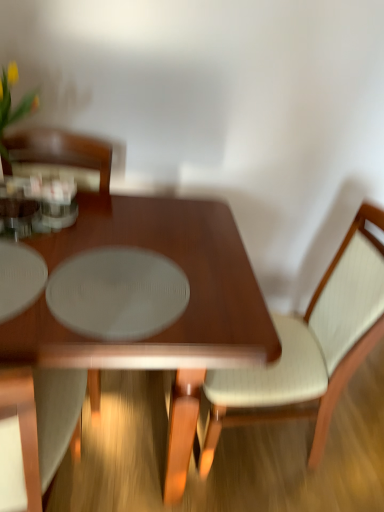
Describe the element at coordinates (155, 335) in the screenshot. I see `shiny brown table at center` at that location.

Describe the element at coordinates (310, 347) in the screenshot. I see `light beige fabric chair at center, placed as the 2th chair when sorted from left to right` at that location.

The height and width of the screenshot is (512, 384). Identify the location of shiny brown table at center. (155, 335).

From their relative heights in the image, would you say white fabric chair at left, the 1th chair from the left, is taller or shorter than light beige fabric chair at center, positioned as the first chair in right-to-left order?

Clearly, white fabric chair at left, the 1th chair from the left, is taller compared to light beige fabric chair at center, positioned as the first chair in right-to-left order.

Does white fabric chair at left, the 1th chair from the left, have a larger size compared to light beige fabric chair at center, placed as the 2th chair when sorted from left to right?

Actually, white fabric chair at left, the 1th chair from the left, might be smaller than light beige fabric chair at center, placed as the 2th chair when sorted from left to right.

Based on the photo, from the image's perspective, relative to light beige fabric chair at center, placed as the 2th chair when sorted from left to right, is white fabric chair at left, acting as the 2th chair starting from the right, above or below?

From the image's perspective, white fabric chair at left, acting as the 2th chair starting from the right, appears below light beige fabric chair at center, placed as the 2th chair when sorted from left to right.

Image resolution: width=384 pixels, height=512 pixels. In the image, there is a white fabric chair at left, the 1th chair from the left. Identify the location of chair below it (from a real-world perspective). (310, 347).

Image resolution: width=384 pixels, height=512 pixels. I want to click on chair that is the 1st one above the shiny brown table at center (from a real-world perspective), so click(310, 347).

Which object is positioned more to the left, shiny brown table at center or light beige fabric chair at center, positioned as the first chair in right-to-left order?

shiny brown table at center is more to the left.

Does point (167, 230) come closer to viewer compared to point (225, 423)?

Yes, it is.

Who is more distant, shiny brown table at center or white fabric chair at left, the 1th chair from the left?

shiny brown table at center is behind.

Would you consider shiny brown table at center to be distant from white fabric chair at left, acting as the 2th chair starting from the right?

No, shiny brown table at center is in close proximity to white fabric chair at left, acting as the 2th chair starting from the right.

Measure the distance between shiny brown table at center and white fabric chair at left, acting as the 2th chair starting from the right.

shiny brown table at center and white fabric chair at left, acting as the 2th chair starting from the right, are 13.07 inches apart.

Does shiny brown table at center turn towards white fabric chair at left, acting as the 2th chair starting from the right?

Yes, shiny brown table at center is turned towards white fabric chair at left, acting as the 2th chair starting from the right.

Is light beige fabric chair at center, positioned as the first chair in right-to-left order, positioned with its back to shiny brown table at center?

No, shiny brown table at center is not at the back of light beige fabric chair at center, positioned as the first chair in right-to-left order.

At what (x,y) coordinates should I click in order to perform the action: click on coffee table that is on the left side of light beige fabric chair at center, positioned as the first chair in right-to-left order. Please return your answer as a coordinate pair (x, y). The image size is (384, 512). Looking at the image, I should click on (155, 335).

Can you confirm if light beige fabric chair at center, placed as the 2th chair when sorted from left to right, is shorter than shiny brown table at center?

Incorrect, the height of light beige fabric chair at center, placed as the 2th chair when sorted from left to right, does not fall short of that of shiny brown table at center.

From the image's perspective, is light beige fabric chair at center, placed as the 2th chair when sorted from left to right, beneath shiny brown table at center?

No.

Is light beige fabric chair at center, positioned as the first chair in right-to-left order, at the left side of white fabric chair at left, acting as the 2th chair starting from the right?

Incorrect, light beige fabric chair at center, positioned as the first chair in right-to-left order, is not on the left side of white fabric chair at left, acting as the 2th chair starting from the right.

Does light beige fabric chair at center, positioned as the first chair in right-to-left order, have a greater height compared to white fabric chair at left, the 1th chair from the left?

No, light beige fabric chair at center, positioned as the first chair in right-to-left order, is not taller than white fabric chair at left, the 1th chair from the left.

From the image's perspective, is light beige fabric chair at center, placed as the 2th chair when sorted from left to right, positioned above or below white fabric chair at left, the 1th chair from the left?

Clearly, from the image's perspective, light beige fabric chair at center, placed as the 2th chair when sorted from left to right, is above white fabric chair at left, the 1th chair from the left.

Is point (57, 430) closer or farther from the camera than point (29, 389)?

Point (57, 430) appears to be farther away from the viewer than point (29, 389).

Considering the relative positions of white fabric chair at left, the 1th chair from the left, and shiny brown table at center in the image provided, is white fabric chair at left, the 1th chair from the left, to the right of shiny brown table at center from the viewer's perspective?

Incorrect, white fabric chair at left, the 1th chair from the left, is not on the right side of shiny brown table at center.

Considering the relative sizes of white fabric chair at left, the 1th chair from the left, and shiny brown table at center in the image provided, is white fabric chair at left, the 1th chair from the left, shorter than shiny brown table at center?

No.

Is white fabric chair at left, acting as the 2th chair starting from the right, positioned far away from shiny brown table at center?

No, white fabric chair at left, acting as the 2th chair starting from the right, is not far from shiny brown table at center.

Identify the location of chair behind the white fabric chair at left, the 1th chair from the left. The image size is (384, 512). (310, 347).

Locate an element on the screen. The height and width of the screenshot is (512, 384). coffee table on the left of the light beige fabric chair at center, positioned as the first chair in right-to-left order is located at coordinates (155, 335).

From the picture: Looking at the image, which one is located further to white fabric chair at left, the 1th chair from the left, shiny brown table at center or light beige fabric chair at center, positioned as the first chair in right-to-left order?

light beige fabric chair at center, positioned as the first chair in right-to-left order.

Looking at the image, which one is located closer to light beige fabric chair at center, positioned as the first chair in right-to-left order, white fabric chair at left, acting as the 2th chair starting from the right, or shiny brown table at center?

shiny brown table at center.

Estimate the real-world distances between objects in this image. Which object is further from light beige fabric chair at center, positioned as the first chair in right-to-left order, shiny brown table at center or white fabric chair at left, acting as the 2th chair starting from the right?

The object further to light beige fabric chair at center, positioned as the first chair in right-to-left order, is white fabric chair at left, acting as the 2th chair starting from the right.

Looking at the image, which one is located closer to white fabric chair at left, acting as the 2th chair starting from the right, light beige fabric chair at center, positioned as the first chair in right-to-left order, or shiny brown table at center?

Among the two, shiny brown table at center is located nearer to white fabric chair at left, acting as the 2th chair starting from the right.

Based on their spatial positions, is light beige fabric chair at center, placed as the 2th chair when sorted from left to right, or white fabric chair at left, acting as the 2th chair starting from the right, closer to shiny brown table at center?

Based on the image, white fabric chair at left, acting as the 2th chair starting from the right, appears to be nearer to shiny brown table at center.

In the scene shown: Looking at the image, which one is located closer to shiny brown table at center, white fabric chair at left, the 1th chair from the left, or light beige fabric chair at center, placed as the 2th chair when sorted from left to right?

Among the two, white fabric chair at left, the 1th chair from the left, is located nearer to shiny brown table at center.

Where is `coffee table between white fabric chair at left, acting as the 2th chair starting from the right, and light beige fabric chair at center, placed as the 2th chair when sorted from left to right, from left to right`? The height and width of the screenshot is (512, 384). coffee table between white fabric chair at left, acting as the 2th chair starting from the right, and light beige fabric chair at center, placed as the 2th chair when sorted from left to right, from left to right is located at coordinates (155, 335).